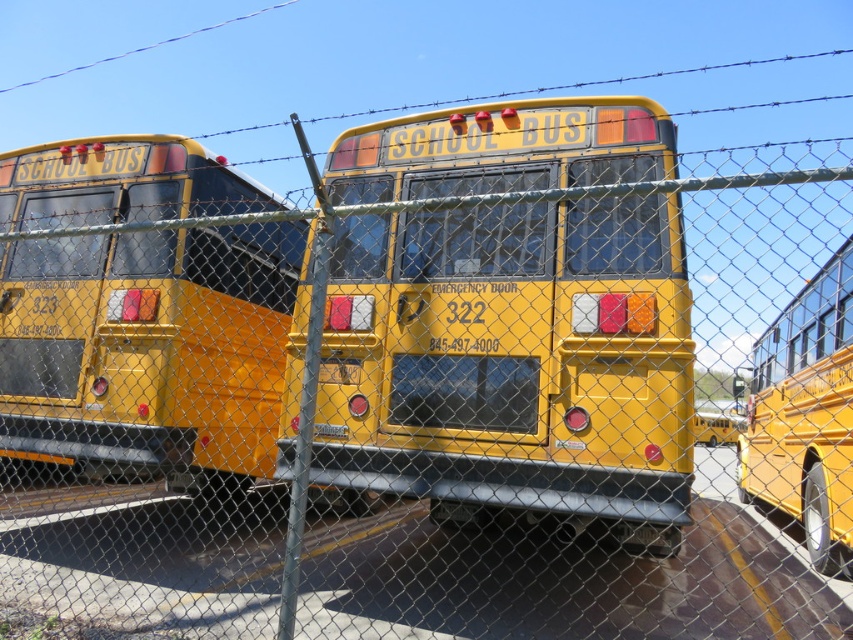
You are standing at the fence looking at the school buses. There are two points marked on the ground near the buses. The first point is at coordinates point (315, 461) and the second point is at point (248, 413). Which point is closer to you?

Point (315, 461) is closer to you because it is in front of point (248, 413).